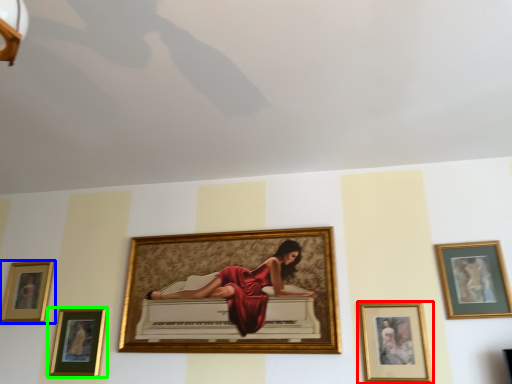
Question: Which object is positioned farthest from picture frame (highlighted by a red box)? Select from picture frame (highlighted by a blue box) and picture frame (highlighted by a green box).

Choices:
 (A) picture frame
 (B) picture frame

Answer: (A)